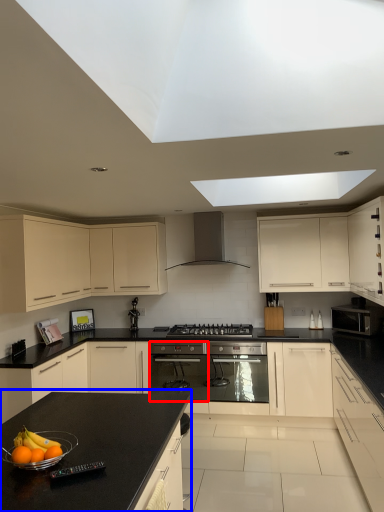
Question: Which of the following is the closest to the observer, appliance (highlighted by a red box) or countertop (highlighted by a blue box)?

Choices:
 (A) appliance
 (B) countertop

Answer: (B)